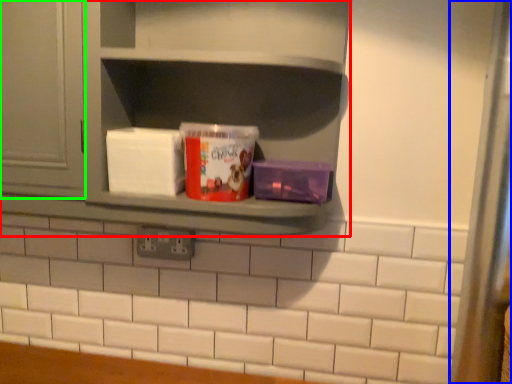
Question: Estimate the real-world distances between objects in this image. Which object is closer to shelf (highlighted by a red box), glass door (highlighted by a blue box) or window (highlighted by a green box)?

Choices:
 (A) glass door
 (B) window

Answer: (B)